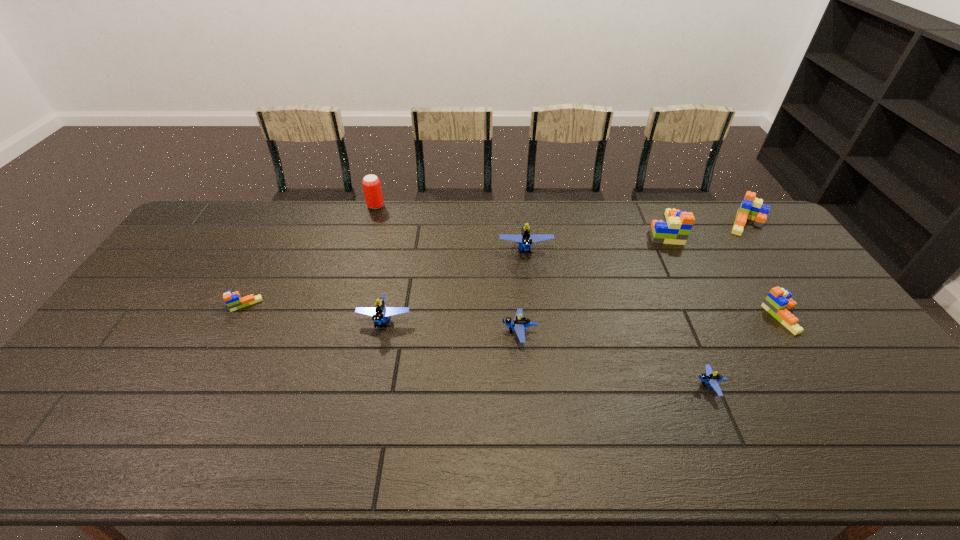
In order to click on vacant region located 0.270m on the front-facing side of the third biggest blue Lego in this screenshot , I will do `click(406, 333)`.

Locate an element on the screen. This screenshot has height=540, width=960. free space located on the front-facing side of the third biggest blue Lego is located at coordinates (367, 333).

Identify the location of vacant space located on the back of the leftmost Lego. The width and height of the screenshot is (960, 540). coord(284,226).

The height and width of the screenshot is (540, 960). What are the coordinates of `free location located 0.360m on the front-facing side of the nearest blue Lego` in the screenshot? It's located at (553, 386).

Locate an element on the screen. vacant region located 0.180m on the front-facing side of the nearest blue Lego is located at coordinates (x=624, y=386).

The width and height of the screenshot is (960, 540). Find the location of `vacant space located on the front-facing side of the nearest blue Lego`. vacant space located on the front-facing side of the nearest blue Lego is located at coordinates (577, 386).

You are a GUI agent. You are given a task and a screenshot of the screen. Output one action in this format:
    pyautogui.click(x=<x>, y=<y>)
    Task: Click on the beer can present at the far edge
    Image resolution: width=960 pixels, height=540 pixels.
    Given the screenshot: What is the action you would take?
    pyautogui.click(x=371, y=184)

I want to click on object located in the far right corner section of the desktop, so click(751, 208).

In the image, there is a desktop. Where is `vacant area at the far edge`? The height and width of the screenshot is (540, 960). vacant area at the far edge is located at coordinates (246, 231).

Locate an element on the screen. The image size is (960, 540). free space at the left edge is located at coordinates (145, 285).